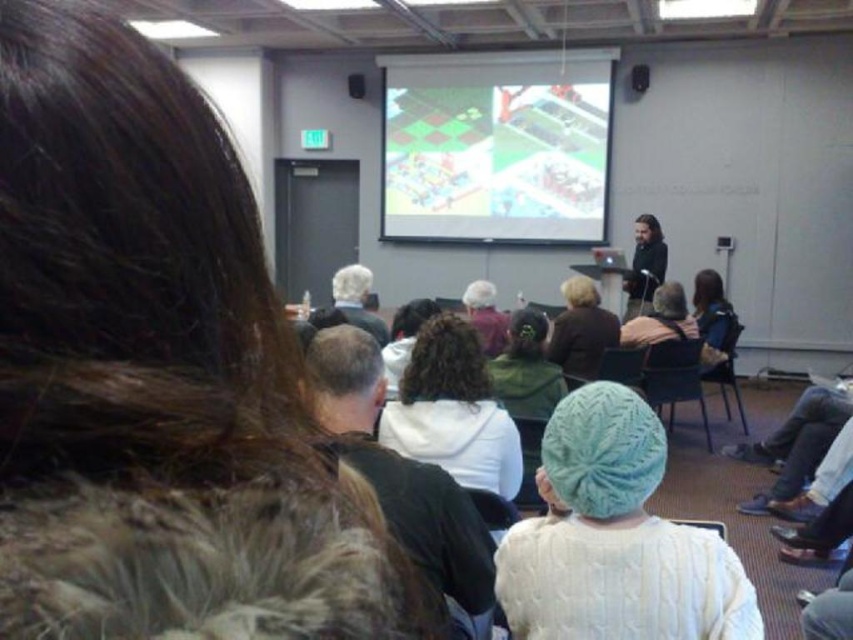
In the scene shown: You are a photographer in the audience and want to take a photo of the white fleece jacket at center and dark brown hair at center. Which object is on the left side when you look at them from your seat?

The white fleece jacket at center is positioned on the left side of dark brown hair at center, so when looking from your seat, the white fleece jacket at center is on the left side.

You are sitting in the front row of the presentation and want to hand a note to the person wearing the white fleece jacket at center. The room has a 6.5 feet clearance between rows. Can you reach them without leaving your seat?

The distance between you and the white fleece jacket at center is 6.35 feet, which is slightly less than the 6.5 feet clearance between rows. Therefore, you can likely reach them without leaving your seat.

You are organizing a workshop and need to ensure that a purple knit hat at center can fit on a dark gray plastic chair at center without falling off. Based on the image, is there enough space for the hat to stay securely on the chair?

The dark gray plastic chair at center might be wider than purple knit hat at center, so there is likely enough space for the purple knit hat at center to stay securely on the dark gray plastic chair at center without falling off.